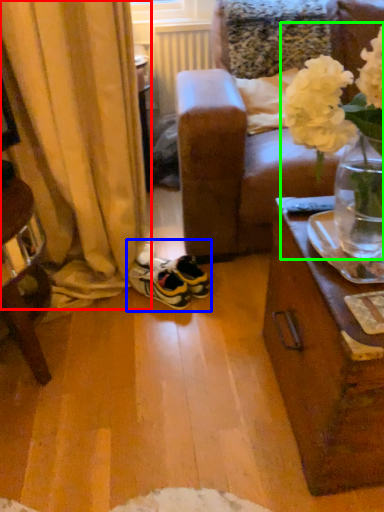
Question: Which is farther away from curtain (highlighted by a red box)? footwear (highlighted by a blue box) or floral arrangement (highlighted by a green box)?

Choices:
 (A) footwear
 (B) floral arrangement

Answer: (B)